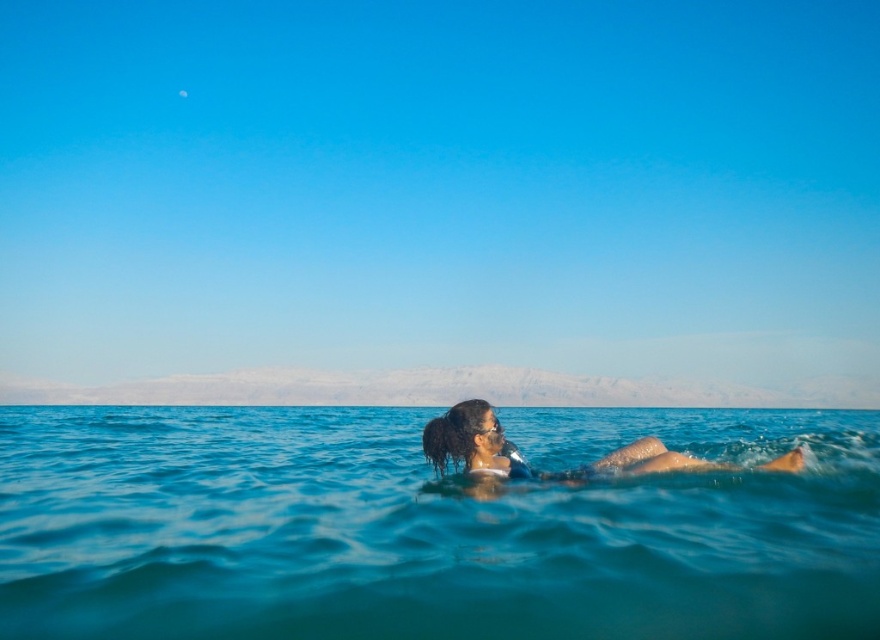
Question: Among these points, which one is nearest to the camera?

Choices:
 (A) (617, 460)
 (B) (441, 596)

Answer: (B)

Question: Is clear blue water at center bigger than dark brown hair at center?

Choices:
 (A) yes
 (B) no

Answer: (A)

Question: Is clear blue water at center to the right of dark brown hair at center from the viewer's perspective?

Choices:
 (A) yes
 (B) no

Answer: (A)

Question: Is clear blue water at center below dark brown hair at center?

Choices:
 (A) no
 (B) yes

Answer: (B)